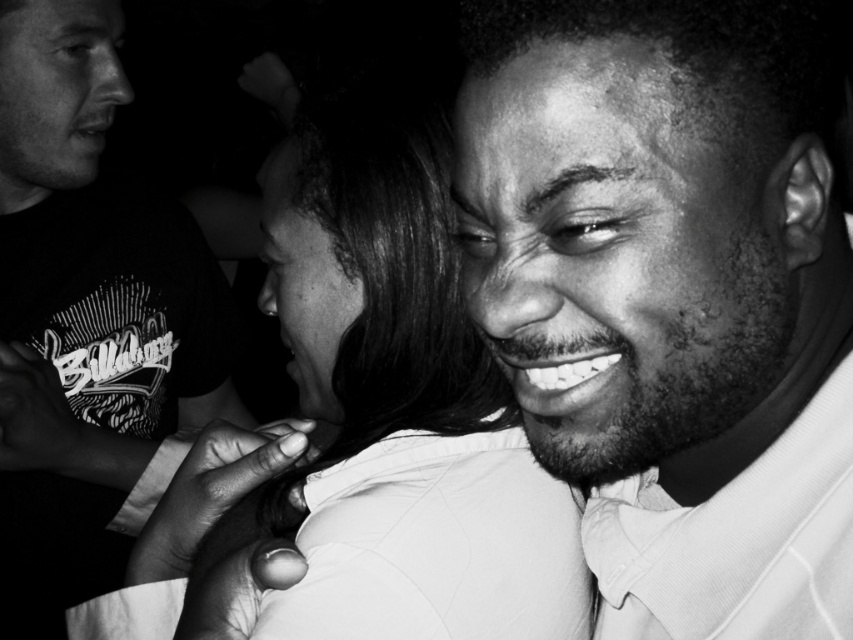
Consider the image. Based on the scene described, can you determine which object is wider between the smooth skin face at center and the matte black shirt at upper left?

The matte black shirt at upper left is wider than the smooth skin face at center.

What is the relationship between the smooth skin face at center and the smooth skin at center in the image?

The smooth skin face at center is positioned over smooth skin at center.